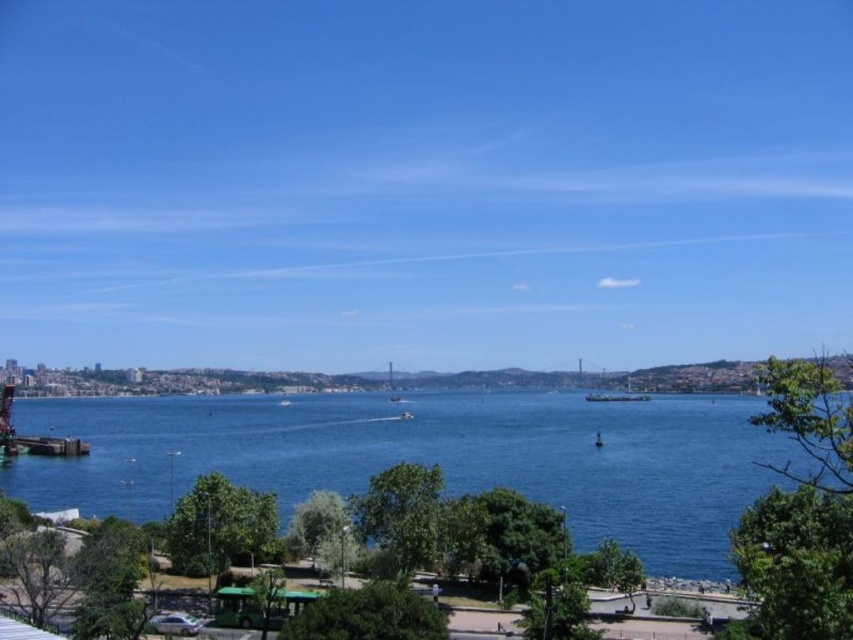
Question: Can you confirm if blue water at center is wider than wooden dock at lower left?

Choices:
 (A) no
 (B) yes

Answer: (B)

Question: Among these objects, which one is nearest to the camera?

Choices:
 (A) blue water at center
 (B) wooden dock at lower left

Answer: (A)

Question: Which object appears farthest from the camera in this image?

Choices:
 (A) blue water at center
 (B) wooden dock at lower left

Answer: (B)

Question: Which object is closer to the camera taking this photo?

Choices:
 (A) wooden dock at lower left
 (B) blue water at center

Answer: (B)

Question: Observing the image, what is the correct spatial positioning of blue water at center in reference to wooden dock at lower left?

Choices:
 (A) left
 (B) right

Answer: (B)

Question: Is blue water at center thinner than wooden dock at lower left?

Choices:
 (A) yes
 (B) no

Answer: (B)